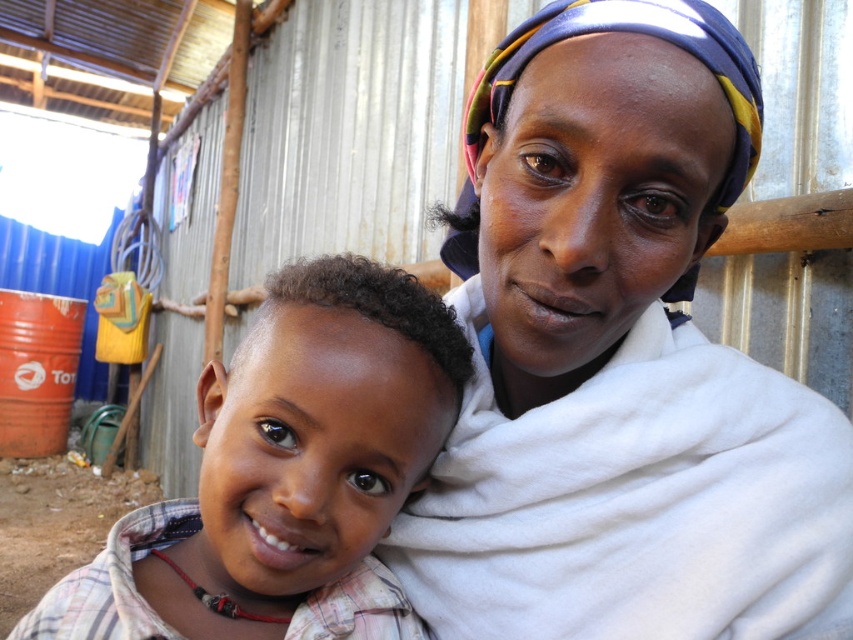
Is white cloth at center to the right of light brown plaid shirt at center from the viewer's perspective?

Yes, white cloth at center is to the right of light brown plaid shirt at center.

What do you see at coordinates (618, 358) in the screenshot? I see `white cloth at center` at bounding box center [618, 358].

Is point (480, 483) less distant than point (271, 378)?

No, (480, 483) is behind (271, 378).

Find the location of a particular element. This screenshot has height=640, width=853. white cloth at center is located at coordinates (618, 358).